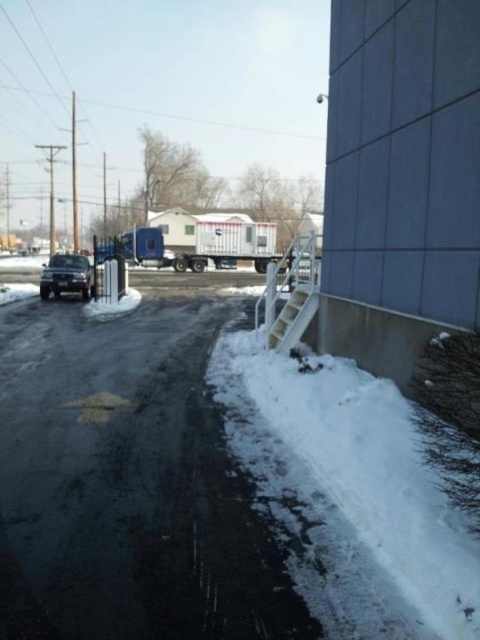
You are a delivery person trying to park your van between the white fluffy snow at lower right and the shiny black sedan at left. Can you fit your van there if it is 2.5 meters wide?

The white fluffy snow at lower right has a lesser width compared to the shiny black sedan at left, but the exact width between them isn t specified. Without knowing the distance between the two objects, it s impossible to determine if the van can fit.

You are a delivery driver who needs to park your vehicle in a garage that has a height restriction of 2 meters. You have a white plastic trailer truck at center and a shiny black sedan at left. Which vehicle should you choose to park in the garage without hitting the ceiling?

The shiny black sedan at left should be chosen because the white plastic trailer truck at center is much taller than the shiny black sedan at left, making it more likely to exceed the garage height limit.

You are a delivery person trying to park your white plastic trailer truck at center on the snow. Can the truck be parked on the white fluffy snow at lower right without sinking?

The white fluffy snow at lower right is thinner than the white plastic trailer truck at center, so the truck might sink into the snow because the snow is not thick enough to support its weight.